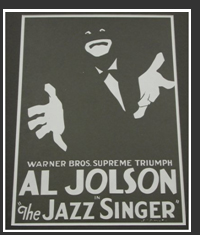
Where is `frame`? This screenshot has width=200, height=235. frame is located at coordinates (20, 36).